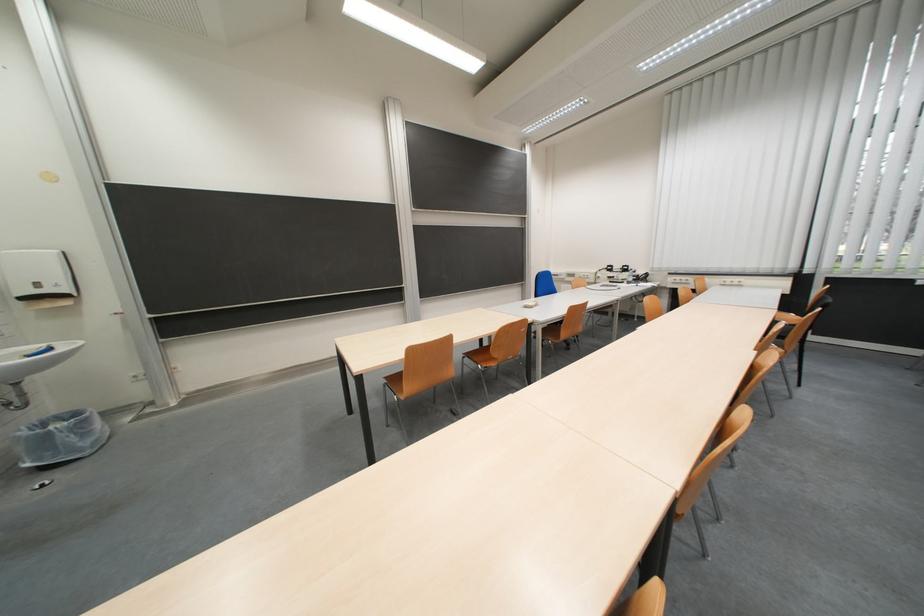
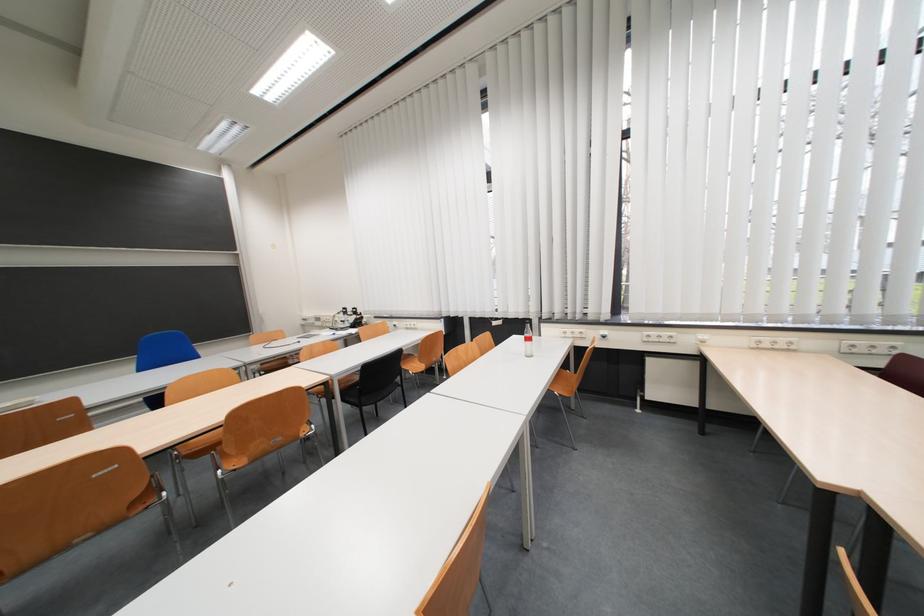
In the second image, find the point that corresponds to point 624,273 in the first image.

(357, 315)